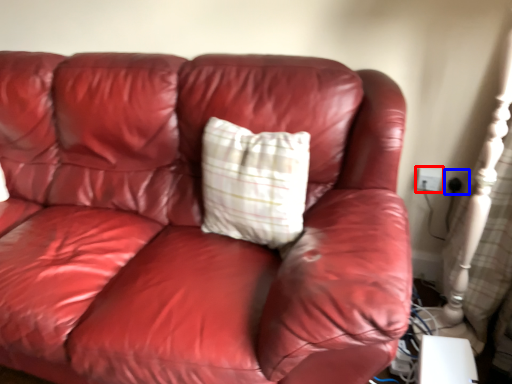
Question: Which point is closer to the camera, electric outlet (highlighted by a red box) or electric outlet (highlighted by a blue box)?

Choices:
 (A) electric outlet
 (B) electric outlet

Answer: (B)